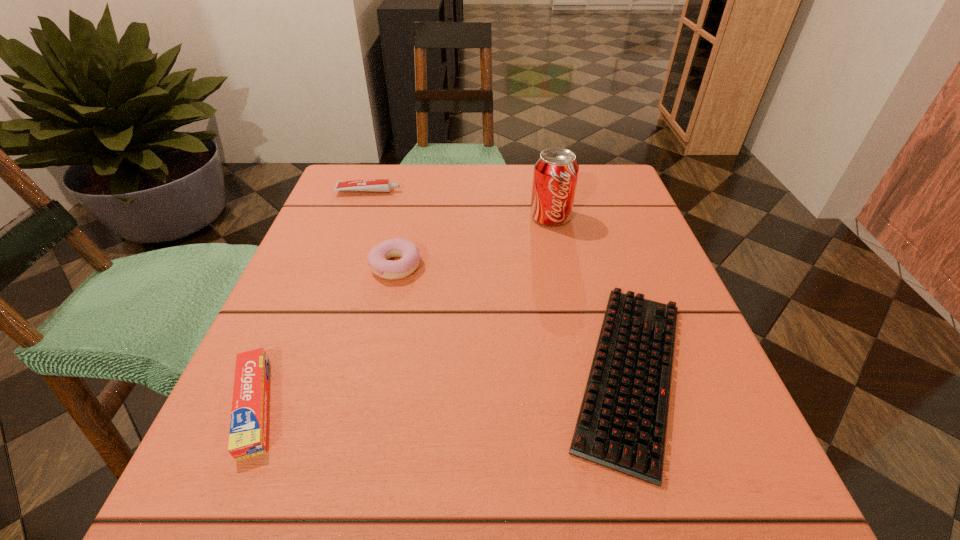
Find the location of `vacant point located between the farther toothpaste and the second tallest object`. vacant point located between the farther toothpaste and the second tallest object is located at coordinates (382, 228).

Where is `vacant space that is in between the shortest object and the doughnut`? The height and width of the screenshot is (540, 960). vacant space that is in between the shortest object and the doughnut is located at coordinates (513, 319).

The height and width of the screenshot is (540, 960). I want to click on empty location between the nearer toothpaste and the farthest object, so click(x=311, y=298).

In order to click on vacant area that lies between the computer keyboard and the fourth nearest object in this screenshot , I will do `click(590, 294)`.

This screenshot has width=960, height=540. What are the coordinates of `vacant area that lies between the computer keyboard and the soda can` in the screenshot? It's located at (590, 294).

Find the location of `empty location between the farther toothpaste and the computer keyboard`. empty location between the farther toothpaste and the computer keyboard is located at coordinates (499, 281).

Locate an element on the screen. vacant area between the nearer toothpaste and the doughnut is located at coordinates (324, 335).

Locate an element on the screen. empty space between the shortest object and the soda can is located at coordinates (590, 294).

Identify the location of object that ranks as the closest to the shortest object. (556, 170).

The height and width of the screenshot is (540, 960). What are the coordinates of `the second closest object to the shortest object` in the screenshot? It's located at (377, 259).